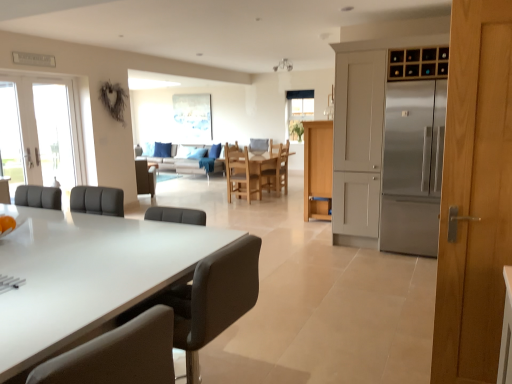
Question: Considering the relative positions of stainless steel refrigerator at right and wooden chair at center, positioned as the 2th chair in right-to-left order, in the image provided, is stainless steel refrigerator at right to the right of wooden chair at center, positioned as the 2th chair in right-to-left order, from the viewer's perspective?

Choices:
 (A) no
 (B) yes

Answer: (B)

Question: Can you see stainless steel refrigerator at right touching wooden chair at center, placed as the 3th chair when sorted from front to back?

Choices:
 (A) no
 (B) yes

Answer: (A)

Question: Is stainless steel refrigerator at right further to the viewer compared to wooden chair at center, positioned as the 2th chair in right-to-left order?

Choices:
 (A) yes
 (B) no

Answer: (B)

Question: Would you say stainless steel refrigerator at right is outside wooden chair at center, positioned as the 2th chair in right-to-left order?

Choices:
 (A) yes
 (B) no

Answer: (A)

Question: Does stainless steel refrigerator at right lie in front of wooden chair at center, placed as the 3th chair when sorted from front to back?

Choices:
 (A) no
 (B) yes

Answer: (B)

Question: Is stainless steel refrigerator at right in front of or behind wooden wine rack at upper right, marked as the 1th cabinetry in a right-to-left arrangement, in the image?

Choices:
 (A) front
 (B) behind

Answer: (A)

Question: Is stainless steel refrigerator at right taller or shorter than wooden wine rack at upper right, marked as the second cabinetry in a bottom-to-top arrangement?

Choices:
 (A) tall
 (B) short

Answer: (A)

Question: From a real-world perspective, relative to wooden wine rack at upper right, acting as the 1th cabinetry starting from the front, is stainless steel refrigerator at right vertically above or below?

Choices:
 (A) below
 (B) above

Answer: (A)

Question: From the image's perspective, is stainless steel refrigerator at right positioned above or below wooden wine rack at upper right, acting as the 1th cabinetry starting from the front?

Choices:
 (A) above
 (B) below

Answer: (B)

Question: From a real-world perspective, is wooden chair at center, the first chair in the right-to-left sequence, above or below light wood cabinet at center, the second cabinetry viewed from the front?

Choices:
 (A) below
 (B) above

Answer: (A)

Question: Relative to light wood cabinet at center, the 1th cabinetry when ordered from left to right, is wooden chair at center, the 5th chair from the front, in front or behind?

Choices:
 (A) front
 (B) behind

Answer: (B)

Question: Would you say wooden chair at center, the fifth chair positioned from the left, is inside or outside light wood cabinet at center, which appears as the 2th cabinetry when viewed from the right?

Choices:
 (A) outside
 (B) inside

Answer: (A)

Question: Does point (278, 188) appear closer or farther from the camera than point (328, 196)?

Choices:
 (A) closer
 (B) farther

Answer: (B)

Question: From their relative heights in the image, would you say black leather chair at center, arranged as the 3th chair when viewed from the right, is taller or shorter than wooden chair at center, which is counted as the first chair, starting from the back?

Choices:
 (A) short
 (B) tall

Answer: (A)

Question: Looking at their shapes, would you say black leather chair at center, acting as the 3th chair starting from the left, is wider or thinner than wooden chair at center, which is counted as the first chair, starting from the back?

Choices:
 (A) thin
 (B) wide

Answer: (B)